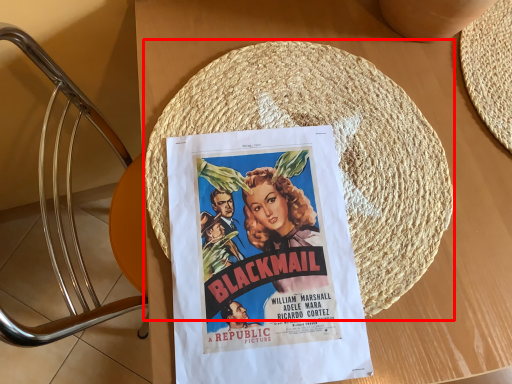
Question: From the image's perspective, considering the relative positions of straw hat (annotated by the red box) and poster in the image provided, where is straw hat (annotated by the red box) located with respect to the staircase?

Choices:
 (A) below
 (B) above

Answer: (B)